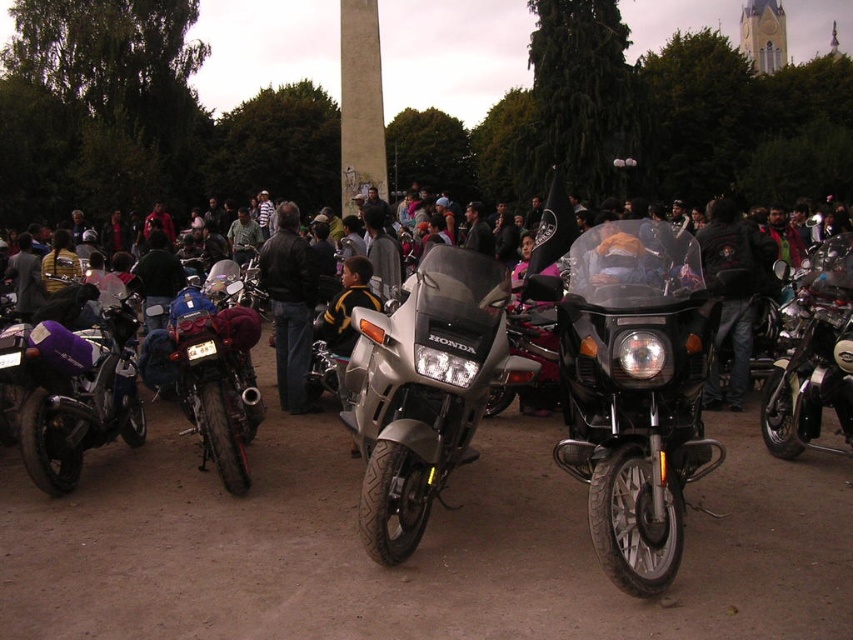
Question: In this image, where is silver metallic motorcycle at center located relative to brushed metal motorcycle at center?

Choices:
 (A) right
 (B) left

Answer: (A)

Question: Is shiny chrome motorcycle at center wider than black leather jacket at center?

Choices:
 (A) no
 (B) yes

Answer: (A)

Question: From the image, what is the correct spatial relationship of brushed metal motorcycle at center in relation to shiny chrome motorcycle at center?

Choices:
 (A) above
 (B) below

Answer: (B)

Question: Among these points, which one is nearest to the camera?

Choices:
 (A) (252, 400)
 (B) (428, 332)
 (C) (297, 344)

Answer: (B)

Question: Which is farther from the shiny chrome motorcycle at center?

Choices:
 (A) black leather jacket at center
 (B) purple matte bag at left
 (C) silver metallic motorcycle at center
 (D) brushed metal motorcycle at center

Answer: (B)

Question: Based on their relative distances, which object is farther from the black matte motorcycle at center?

Choices:
 (A) black leather jacket at center
 (B) shiny chrome motorcycle at center
 (C) purple matte bag at left
 (D) brushed metal motorcycle at center

Answer: (C)